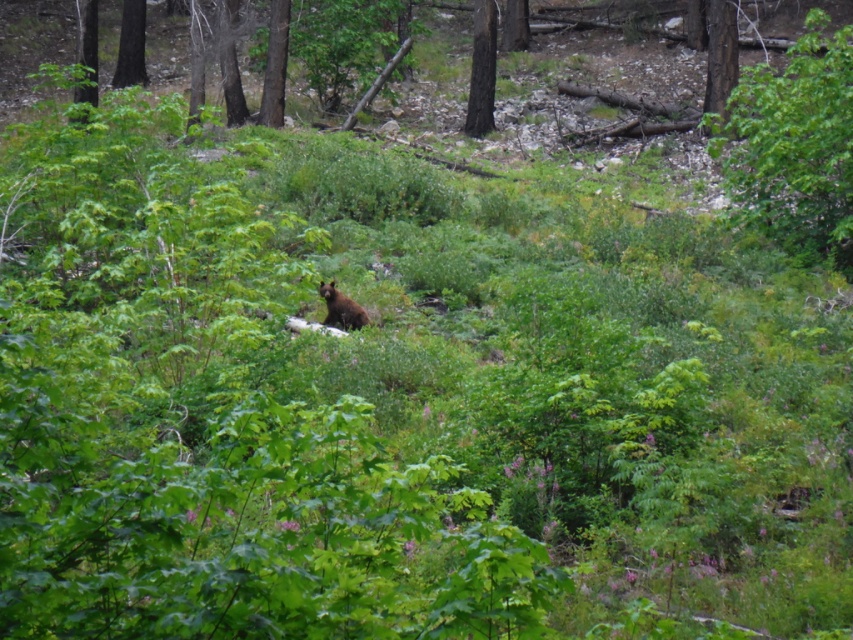
You are standing in the forest and want to determine the relative positions of two points marked in the scene. Which of the two points, point 1 at coordinates point (837, 250) or point 2 at coordinates point (141, 81), is closer to you?

Point 1 at coordinates point (837, 250) is closer to the viewer than point 2 at coordinates point (141, 81).